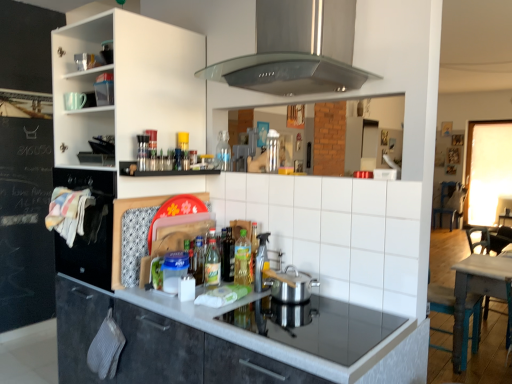
What is the approximate width of matte white cup at upper left, the 1th appliance viewed from the left?

The width of matte white cup at upper left, the 1th appliance viewed from the left, is 7.67 centimeters.

This screenshot has width=512, height=384. What do you see at coordinates (223, 151) in the screenshot? I see `clear glass bottle at center, the 1th bottle viewed from the top` at bounding box center [223, 151].

I want to click on wooden table at right, so click(x=478, y=290).

Describe the element at coordinates (291, 285) in the screenshot. I see `silver metallic pot at center` at that location.

Measure the distance between point (203, 244) and camera.

Point (203, 244) and camera are 2.06 meters apart from each other.

Where is `matte white cup at upper left, which is the 1th appliance in back-to-front order`? matte white cup at upper left, which is the 1th appliance in back-to-front order is located at coordinates [x=74, y=101].

Is silver metallic pot at center oriented towards metallic silver shelf at upper center?

No, silver metallic pot at center does not turn towards metallic silver shelf at upper center.

Is silver metallic pot at center situated inside metallic silver shelf at upper center or outside?

silver metallic pot at center cannot be found inside metallic silver shelf at upper center.

From a real-world perspective, relative to metallic silver shelf at upper center, is silver metallic pot at center vertically above or below?

From a real-world perspective, silver metallic pot at center is physically below metallic silver shelf at upper center.

From a real-world perspective, who is located lower, wooden chair at right, the 2th chair when ordered from left to right, or stainless steel range hood at upper center?

wooden chair at right, the 2th chair when ordered from left to right.

Based on the photo, considering the relative positions of wooden chair at right, the 2th chair when ordered from left to right, and stainless steel range hood at upper center in the image provided, is wooden chair at right, the 2th chair when ordered from left to right, in front of stainless steel range hood at upper center?

No, it is not.

Does wooden chair at right, the 2th chair when ordered from left to right, appear on the right side of stainless steel range hood at upper center?

Yes, wooden chair at right, the 2th chair when ordered from left to right, is to the right of stainless steel range hood at upper center.

Is wooden chair at right, which ranks as the first chair in right-to-left order, outside of stainless steel range hood at upper center?

That's correct, wooden chair at right, which ranks as the first chair in right-to-left order, is outside of stainless steel range hood at upper center.

Is white ceramic tile at center positioned behind wooden table at right?

No, white ceramic tile at center is closer to the viewer.

Which of these two, white ceramic tile at center or wooden table at right, stands shorter?

With less height is white ceramic tile at center.

In the scene shown: Can we say white ceramic tile at center lies outside wooden table at right?

Yes, white ceramic tile at center is outside of wooden table at right.

Between white ceramic tile at center and wooden table at right, which one has smaller size?

white ceramic tile at center.

How different are the orientations of dark gray laminate cabinet at center and translucent plastic bottles at center, which is the third bottle from front to back, in degrees?

They differ by 2.43 degrees in their facing directions.

Would you say dark gray laminate cabinet at center is outside translucent plastic bottles at center, which is the third bottle from front to back?

dark gray laminate cabinet at center is positioned outside translucent plastic bottles at center, which is the third bottle from front to back.

Can you confirm if dark gray laminate cabinet at center is positioned to the right of translucent plastic bottles at center, which is the third bottle from front to back?

Yes, dark gray laminate cabinet at center is to the right of translucent plastic bottles at center, which is the third bottle from front to back.

Considering the sizes of dark gray laminate cabinet at center and translucent plastic bottles at center, which is the third bottle from front to back, in the image, is dark gray laminate cabinet at center taller or shorter than translucent plastic bottles at center, which is the third bottle from front to back,?

Clearly, dark gray laminate cabinet at center is taller compared to translucent plastic bottles at center, which is the third bottle from front to back.

Is there a large distance between matte white cup at upper left, which is the 1th appliance in back-to-front order, and metallic silver shelf at upper center?

No, matte white cup at upper left, which is the 1th appliance in back-to-front order, is in close proximity to metallic silver shelf at upper center.

Considering the relative sizes of matte white cup at upper left, arranged as the 2th appliance when viewed from the right, and metallic silver shelf at upper center in the image provided, is matte white cup at upper left, arranged as the 2th appliance when viewed from the right, smaller than metallic silver shelf at upper center?

Yes.

Is matte white cup at upper left, which is the first appliance in top-to-bottom order, not within metallic silver shelf at upper center?

That's correct, matte white cup at upper left, which is the first appliance in top-to-bottom order, is outside of metallic silver shelf at upper center.

Visually, is wooden chair at right, which appears as the first chair when viewed from the front, positioned to the left or to the right of wooden chair at right, the 2th chair positioned from the front?

wooden chair at right, which appears as the first chair when viewed from the front, is positioned on wooden chair at right, the 2th chair positioned from the front,'s left side.

You are a GUI agent. You are given a task and a screenshot of the screen. Output one action in this format:
    pyautogui.click(x=<x>, y=<y>)
    Task: Click on the chair that is on the right side of wooden chair at right, the first chair viewed from the left
    The height and width of the screenshot is (384, 512).
    Given the screenshot: What is the action you would take?
    pyautogui.click(x=449, y=203)

How far apart are wooden chair at right, which ranks as the second chair in back-to-front order, and wooden chair at right, the 2th chair when ordered from left to right?

20.32 inches.

Would you say white ceramic tile at center is to the left or to the right of wooden chair at right, the first chair viewed from the left, in the picture?

In the image, white ceramic tile at center appears on the left side of wooden chair at right, the first chair viewed from the left.

From a real-world perspective, is white ceramic tile at center positioned above or below wooden chair at right, which appears as the first chair when viewed from the front?

white ceramic tile at center is situated higher than wooden chair at right, which appears as the first chair when viewed from the front, in the real world.

Is white ceramic tile at center far from wooden chair at right, which appears as the first chair when viewed from the front?

Yes.

Does white ceramic tile at center turn towards wooden chair at right, which is the 2th chair in right-to-left order?

No.

Identify the location of shelf on the left of silver metallic pot at center. The width and height of the screenshot is (512, 384). (160, 170).

Identify the location of home appliance above the wooden chair at right, the first chair when ordered from back to front (from the image's perspective). This screenshot has width=512, height=384. (297, 50).

Looking at the image, which one is located closer to wooden chair at right, which ranks as the second chair in back-to-front order, dark gray laminate cabinet at center or green plastic bottle at center, the third bottle when ordered from back to front?

green plastic bottle at center, the third bottle when ordered from back to front, lies closer to wooden chair at right, which ranks as the second chair in back-to-front order, than the other object.

Based on their spatial positions, is translucent plastic bottles at center, positioned as the second bottle in back-to-front order, or white ceramic tile at center further from translucent plastic spray bottle at center, which is the 1th appliance in front-to-back order?

white ceramic tile at center is further to translucent plastic spray bottle at center, which is the 1th appliance in front-to-back order.

When comparing their distances from white ceramic tile at center, does wooden table at right or clear glass bottle at center, the 1th bottle viewed from the back, seem closer?

The object closer to white ceramic tile at center is clear glass bottle at center, the 1th bottle viewed from the back.

Based on their spatial positions, is green plastic bottle at center, positioned as the 2th bottle in bottom-to-top order, or wooden table at right closer to silver metallic pot at center?

Among the two, green plastic bottle at center, positioned as the 2th bottle in bottom-to-top order, is located nearer to silver metallic pot at center.

Which object lies nearer to the anchor point translucent plastic spray bottle at center, which is the first appliance in right-to-left order, translucent plastic bottles at center, which is the third bottle from front to back, or wooden chair at right, which ranks as the second chair in back-to-front order?

translucent plastic bottles at center, which is the third bottle from front to back.

From the image, which object appears to be nearer to clear glass bottle at center, the 4th bottle in the front-to-back sequence, silver metallic pot at center or translucent plastic bottles at center, the third bottle from the bottom?

The object closer to clear glass bottle at center, the 4th bottle in the front-to-back sequence, is translucent plastic bottles at center, the third bottle from the bottom.

From the image, which object appears to be farther from translucent plastic spray bottle at center, the 2th appliance positioned from the left, clear glass bottle at center, the 1th bottle viewed from the back, or translucent plastic bottle at center, which is the 4th bottle from back to front?

clear glass bottle at center, the 1th bottle viewed from the back, is further to translucent plastic spray bottle at center, the 2th appliance positioned from the left.

Estimate the real-world distances between objects in this image. Which object is closer to metallic silver shelf at upper center, wooden chair at right, which ranks as the first chair in right-to-left order, or wooden table at right?

wooden table at right is positioned closer to the anchor metallic silver shelf at upper center.

Locate an element on the screen. cabinetry between green plastic bottle at center, which is counted as the 2th bottle, starting from the front, and wooden table at right, in the horizontal direction is located at coordinates [156, 346].

At what (x,y) coordinates should I click in order to perform the action: click on home appliance between dark gray laminate cabinet at center and wooden table at right in the horizontal direction. Please return your answer as a coordinate pair (x, y). Looking at the image, I should click on (297, 50).

You are a GUI agent. You are given a task and a screenshot of the screen. Output one action in this format:
    pyautogui.click(x=<x>, y=<y>)
    Task: Click on the table positioned between clear glass bottle at center, the 1th bottle viewed from the back, and wooden chair at right, which ranks as the first chair in right-to-left order, from near to far
    
    Given the screenshot: What is the action you would take?
    pyautogui.click(x=478, y=290)

The image size is (512, 384). Find the location of `table between metallic silver shelf at upper center and wooden chair at right, which ranks as the second chair in back-to-front order, in the horizontal direction`. table between metallic silver shelf at upper center and wooden chair at right, which ranks as the second chair in back-to-front order, in the horizontal direction is located at coordinates (478, 290).